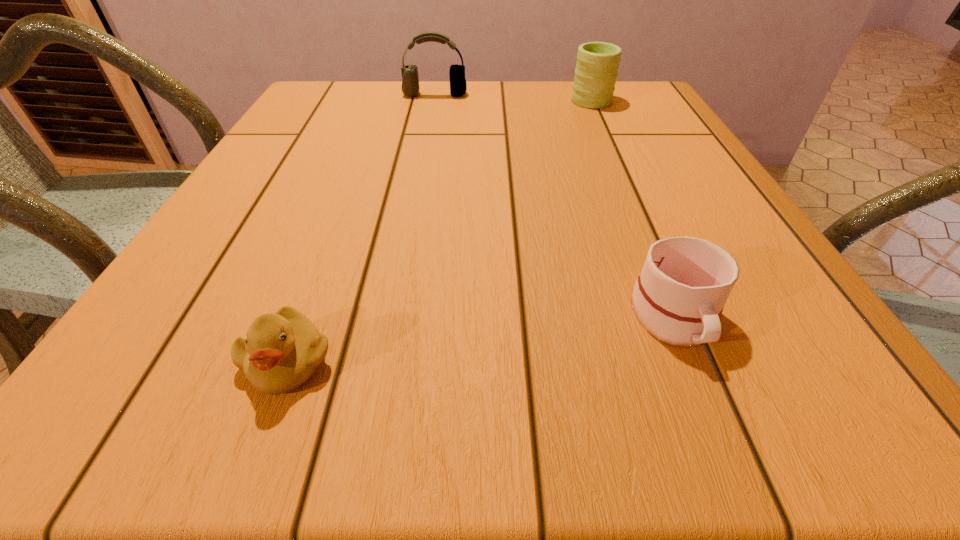
You are a GUI agent. You are given a task and a screenshot of the screen. Output one action in this format:
    pyautogui.click(x=<x>, y=<y>)
    Task: Click on the vacant area at the far right corner of the desktop
    
    Given the screenshot: What is the action you would take?
    pyautogui.click(x=625, y=85)

The image size is (960, 540). In the image, there is a desktop. Find the location of `vacant space at the near right corner`. vacant space at the near right corner is located at coordinates (804, 364).

Identify the location of blank region between the taller mug and the tallest object. (513, 96).

Identify the location of vacant space that is in between the duckling and the farther mug. (439, 229).

What are the coordinates of `free point between the nearer mug and the taller mug` in the screenshot? It's located at (632, 207).

Where is `free space between the shorter mug and the duckling`? free space between the shorter mug and the duckling is located at coordinates (481, 339).

Where is `free spot between the taller mug and the duckling`? The image size is (960, 540). free spot between the taller mug and the duckling is located at coordinates (439, 229).

Where is `empty space that is in between the farther mug and the duckling`? Image resolution: width=960 pixels, height=540 pixels. empty space that is in between the farther mug and the duckling is located at coordinates (439, 229).

This screenshot has height=540, width=960. In order to click on vacant space that's between the farther mug and the tallest object in this screenshot , I will do `click(513, 96)`.

Find the location of a particular element. This screenshot has height=540, width=960. free point between the shorter mug and the tallest object is located at coordinates (555, 205).